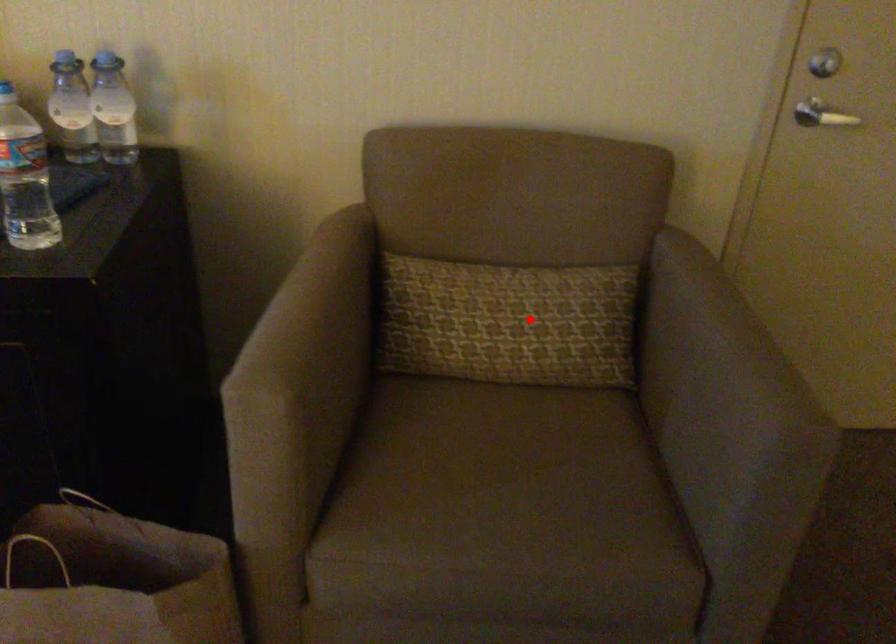
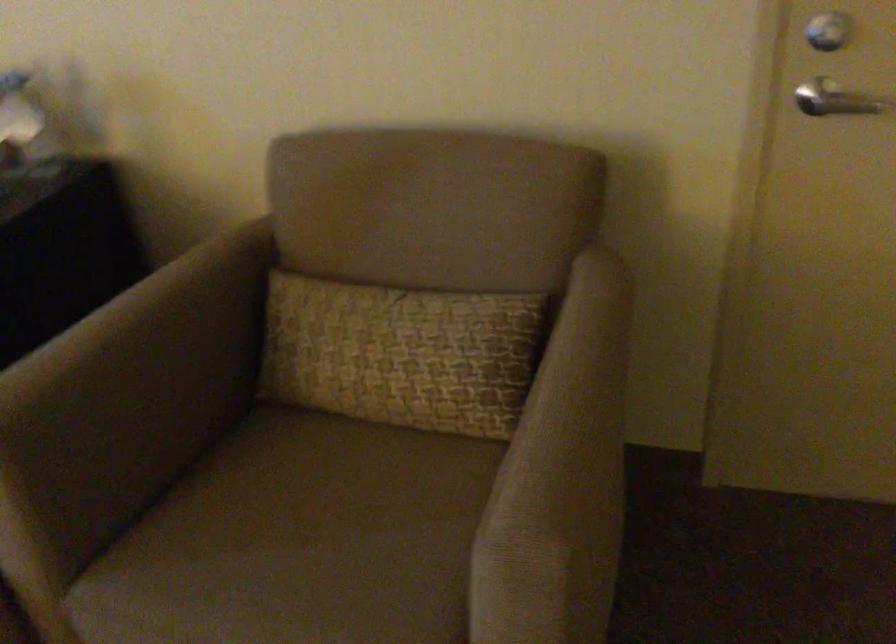
In the second image, find the point that corresponds to the highlighted location in the first image.

(401, 353)